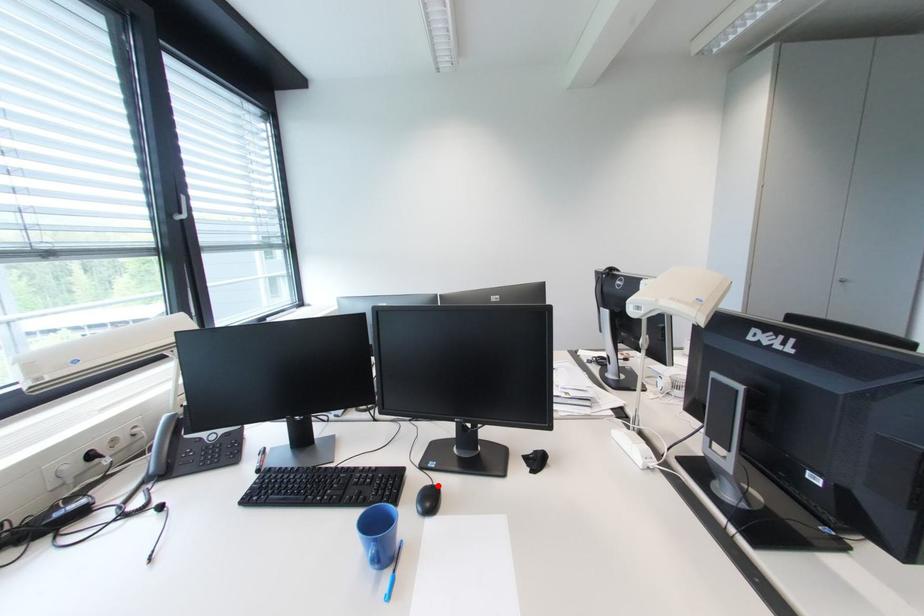
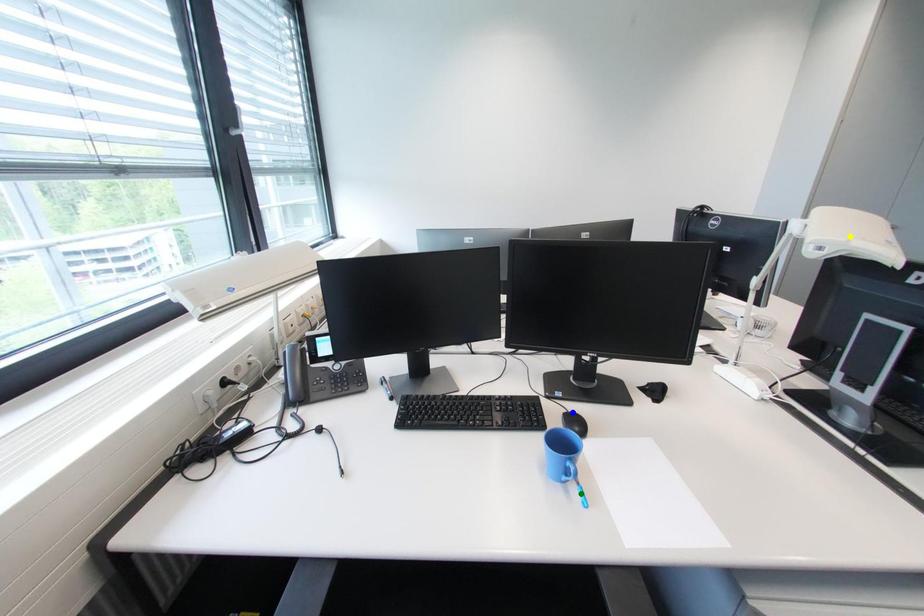
Question: I am providing you with two images of the same scene from different viewpoints. A red point is marked on the first image. You are given multiple points on the second image. Which mark in image 2 goes with the point in image 1?

Choices:
 (A) green point
 (B) blue point
 (C) yellow point

Answer: (B)